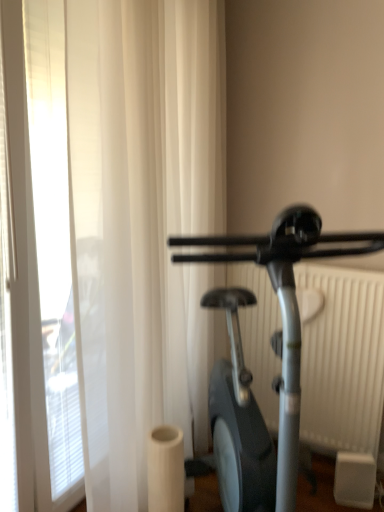
Question: Considering the relative sizes of white sheer curtain at left and white plastic radiator at right in the image provided, is white sheer curtain at left wider than white plastic radiator at right?

Choices:
 (A) yes
 (B) no

Answer: (A)

Question: Does white sheer curtain at left appear on the right side of white plastic radiator at right?

Choices:
 (A) yes
 (B) no

Answer: (B)

Question: Is white sheer curtain at left taller than white plastic radiator at right?

Choices:
 (A) no
 (B) yes

Answer: (B)

Question: Is white sheer curtain at left to the left of white plastic radiator at right from the viewer's perspective?

Choices:
 (A) yes
 (B) no

Answer: (A)

Question: Is white sheer curtain at left thinner than white plastic radiator at right?

Choices:
 (A) yes
 (B) no

Answer: (B)

Question: From a real-world perspective, is silver metallic stationary bicycle at right positioned above or below white sheer curtain at left?

Choices:
 (A) below
 (B) above

Answer: (A)

Question: Is point (218, 242) closer or farther from the camera than point (49, 238)?

Choices:
 (A) closer
 (B) farther

Answer: (A)

Question: In terms of size, does silver metallic stationary bicycle at right appear bigger or smaller than white sheer curtain at left?

Choices:
 (A) small
 (B) big

Answer: (B)

Question: Is silver metallic stationary bicycle at right wider or thinner than white sheer curtain at left?

Choices:
 (A) wide
 (B) thin

Answer: (A)

Question: From a real-world perspective, is white plastic radiator at right positioned above or below white sheer curtain at left?

Choices:
 (A) above
 (B) below

Answer: (B)

Question: Considering the positions of point (326, 332) and point (66, 110), is point (326, 332) closer or farther from the camera than point (66, 110)?

Choices:
 (A) farther
 (B) closer

Answer: (A)

Question: In terms of height, does white plastic radiator at right look taller or shorter compared to white sheer curtain at left?

Choices:
 (A) short
 (B) tall

Answer: (A)

Question: Is white plastic radiator at right to the left or to the right of white sheer curtain at left in the image?

Choices:
 (A) left
 (B) right

Answer: (B)

Question: Considering the positions of white sheer curtain at left and silver metallic stationary bicycle at right in the image, is white sheer curtain at left taller or shorter than silver metallic stationary bicycle at right?

Choices:
 (A) tall
 (B) short

Answer: (A)

Question: From the image's perspective, is white sheer curtain at left located above or below silver metallic stationary bicycle at right?

Choices:
 (A) below
 (B) above

Answer: (B)